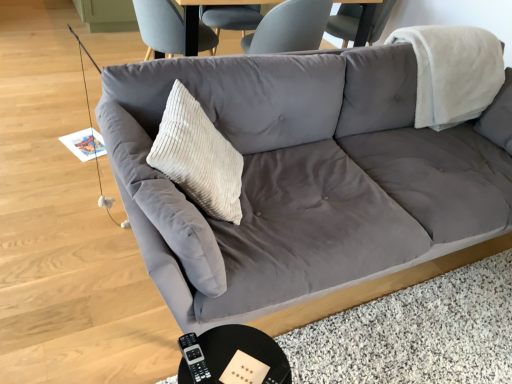
Identify the location of empty space that is ontop of black glossy round table at lower center (from a real-world perspective). The image size is (512, 384). (234, 355).